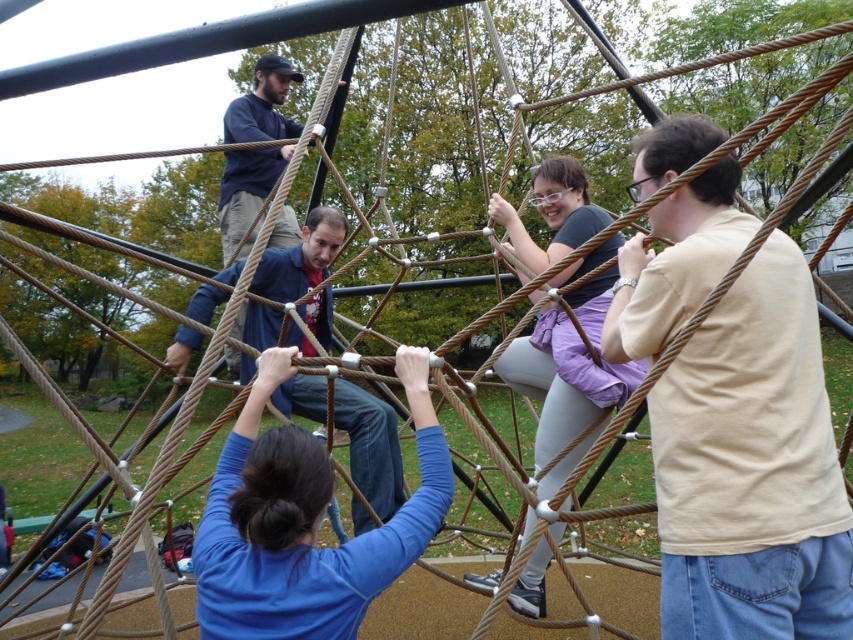
Does blue matte shirt at center appear on the right side of blue denim jeans at center?

Yes, blue matte shirt at center is to the right of blue denim jeans at center.

Is blue matte shirt at center closer to camera compared to blue denim jeans at center?

Yes, it is.

Between point (218, 573) and point (271, 275), which one is positioned behind?

Point (271, 275)

This screenshot has height=640, width=853. I want to click on blue matte shirt at center, so click(x=305, y=524).

Who is shorter, matte purple pants at center or blue denim jeans at center?

Standing shorter between the two is blue denim jeans at center.

Is point (577, 312) in front of point (335, 397)?

Yes, it is in front of point (335, 397).

I want to click on matte purple pants at center, so click(563, 380).

Which is above, blue denim jeans at center or dark blue sweater at upper center?

dark blue sweater at upper center

Does blue denim jeans at center appear under dark blue sweater at upper center?

Correct, blue denim jeans at center is located below dark blue sweater at upper center.

What do you see at coordinates (370, 445) in the screenshot? This screenshot has width=853, height=640. I see `blue denim jeans at center` at bounding box center [370, 445].

Locate an element on the screen. blue denim jeans at center is located at coordinates (370, 445).